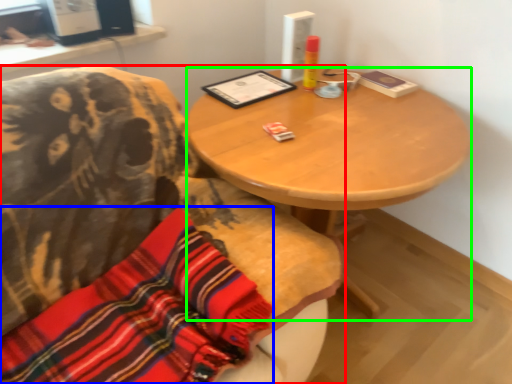
Question: Which is nearer to the chair (highlighted by a red box)? cloth (highlighted by a blue box) or desk (highlighted by a green box).

Choices:
 (A) cloth
 (B) desk

Answer: (A)